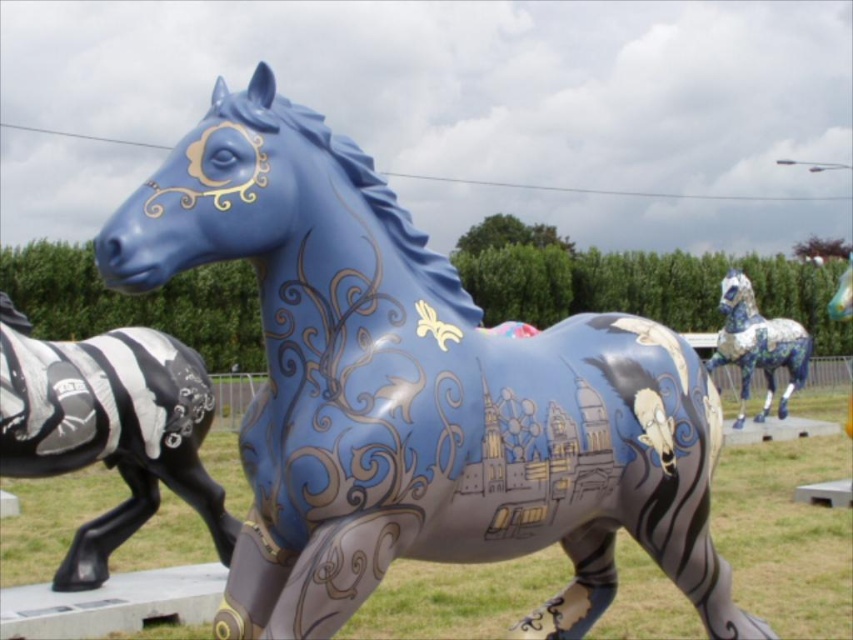
You are an art curator planning to move the metallic silver zebra at left and the porcelain mosaic horse at right to a new exhibition space. The ceiling height in the new space is 3 meters. Given their heights, will both sculptures fit under the ceiling without any modifications?

The metallic silver zebra at left has a lesser height compared to the porcelain mosaic horse at right. Since the porcelain mosaic horse at right is taller, and the ceiling height is 3 meters, we need to know the exact height of the taller sculpture. However, based on the information provided, if the porcelain mosaic horse at right is shorter than 3 meters, both will fit. If it exceeds 3 meters, modifications would be necessary for it.

You are an art curator planning to move the glossy blue horse at center and the porcelain mosaic horse at right into a new exhibition space. The entrance of the exhibition hall is on the right side of the image. Which horse should you move first to ensure the larger one can be positioned near the entrance?

The glossy blue horse at center has a smaller size compared to the porcelain mosaic horse at right. Therefore, you should move the glossy blue horse at center first, allowing the larger porcelain mosaic horse at right to be placed near the entrance without obstruction.

You are an art curator planning to move the metallic silver zebra at left and the porcelain mosaic horse at right to a new exhibition space. If you want to keep their relative positions as in the original image, which object should be placed above the other?

The metallic silver zebra at left should be placed under the porcelain mosaic horse at right to maintain their original positions.